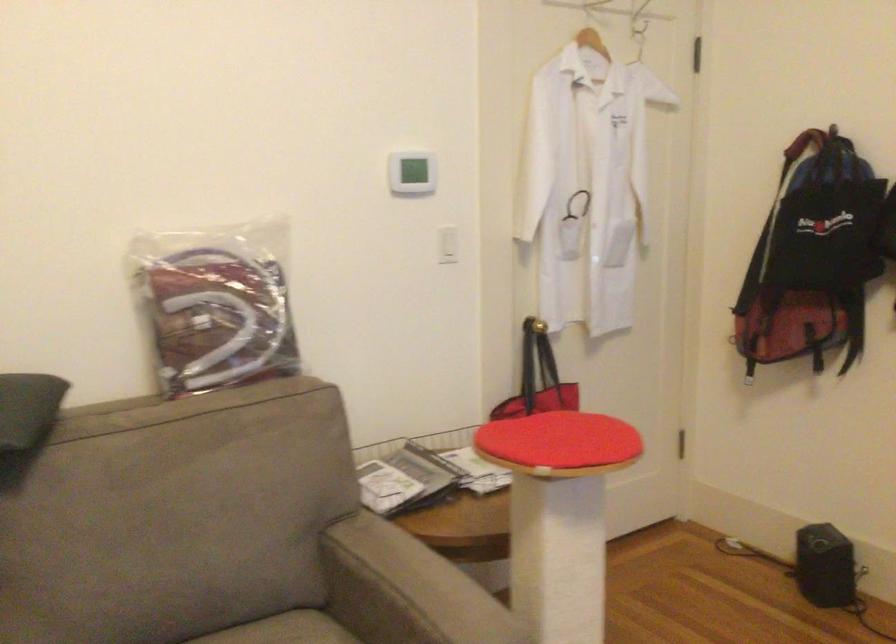
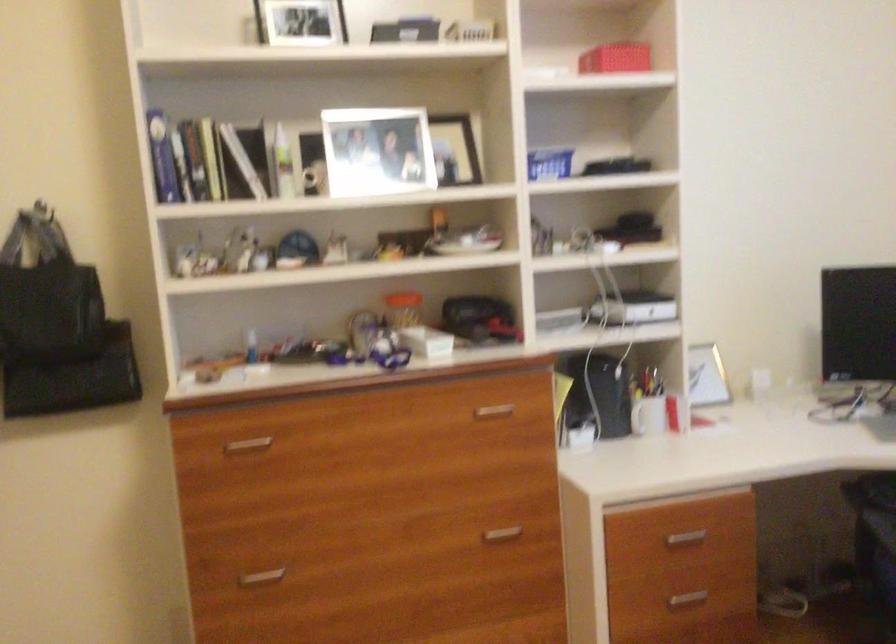
Question: The images are taken continuously from a first-person perspective. In which direction is your viewpoint rotating?

Choices:
 (A) Left
 (B) Right
 (C) Up
 (D) Down

Answer: (B)